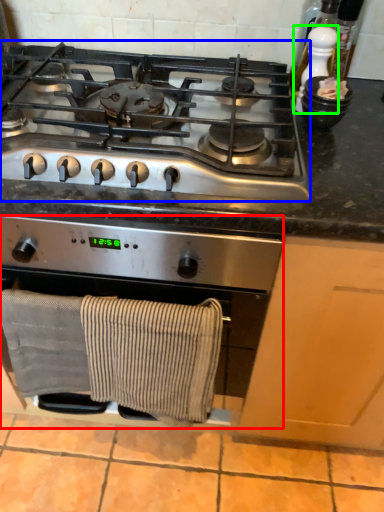
Question: Which is nearer to the kitchen appliance (highlighted by a red box)? gas stove (highlighted by a blue box) or appliance (highlighted by a green box).

Choices:
 (A) gas stove
 (B) appliance

Answer: (A)